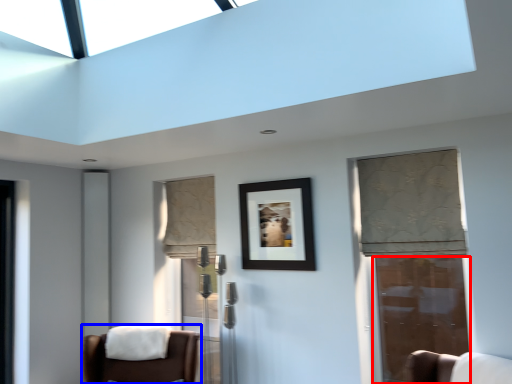
Question: Which object appears farthest to the camera in this image, door (highlighted by a red box) or chair (highlighted by a blue box)?

Choices:
 (A) door
 (B) chair

Answer: (A)